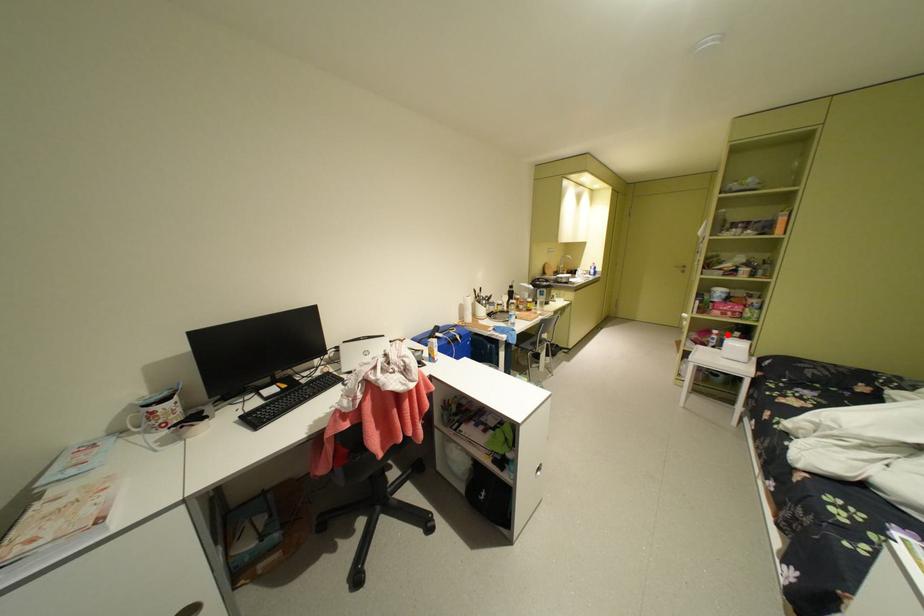
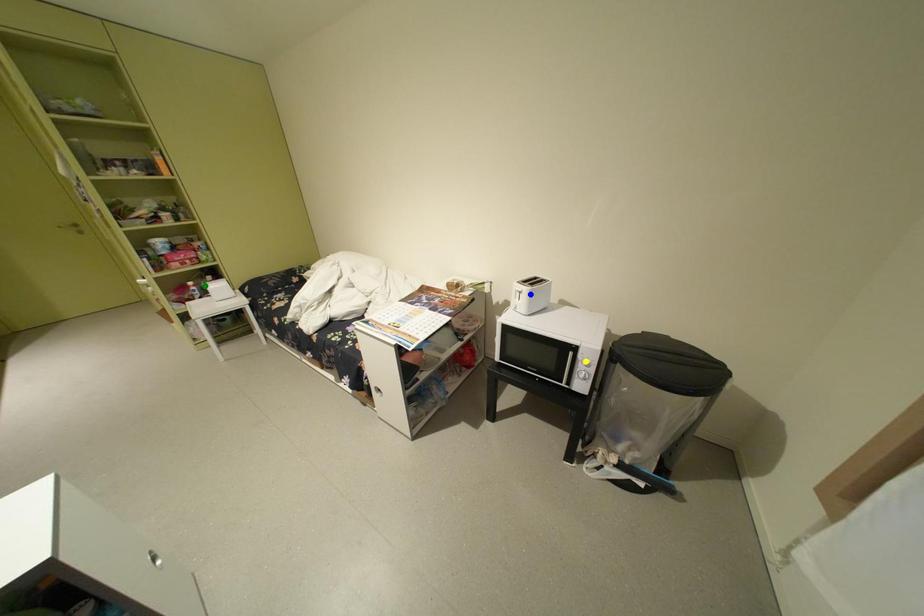
Question: I am providing you with two images of the same scene from different viewpoints. A red point is marked on the first image. You are given multiple points on the second image. Which spot in image 2 lines up with the point in image 1?

Choices:
 (A) blue point
 (B) yellow point
 (C) green point

Answer: (C)